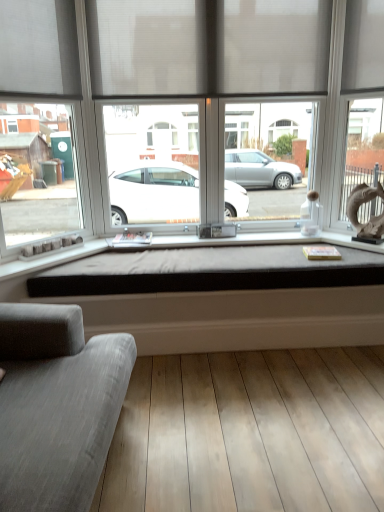
Question: Does point (198, 75) appear closer or farther from the camera than point (14, 200)?

Choices:
 (A) closer
 (B) farther

Answer: (A)

Question: Looking at their shapes, would you say matte gray curtain at upper center is wider or thinner than matte gray window at center?

Choices:
 (A) thin
 (B) wide

Answer: (A)

Question: Considering the real-world distances, which object is closest to the light brown wood floor at lower center?

Choices:
 (A) matte gray curtain at upper center
 (B) matte gray window at center
 (C) gray fabric couch at lower left

Answer: (C)

Question: Estimate the real-world distances between objects in this image. Which object is closer to the gray fabric couch at lower left?

Choices:
 (A) matte gray window at center
 (B) light brown wood floor at lower center
 (C) matte gray curtain at upper center

Answer: (B)